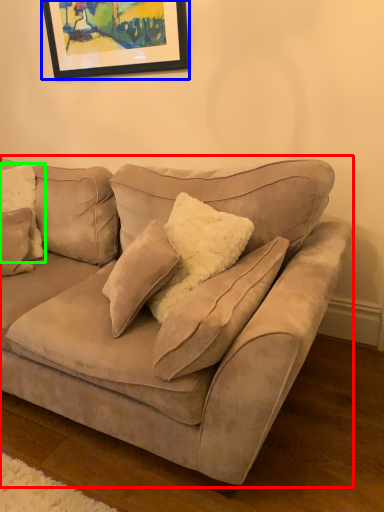
Question: Which is farther away from studio couch (highlighted by a red box)? picture frame (highlighted by a blue box) or pillow (highlighted by a green box)?

Choices:
 (A) picture frame
 (B) pillow

Answer: (A)